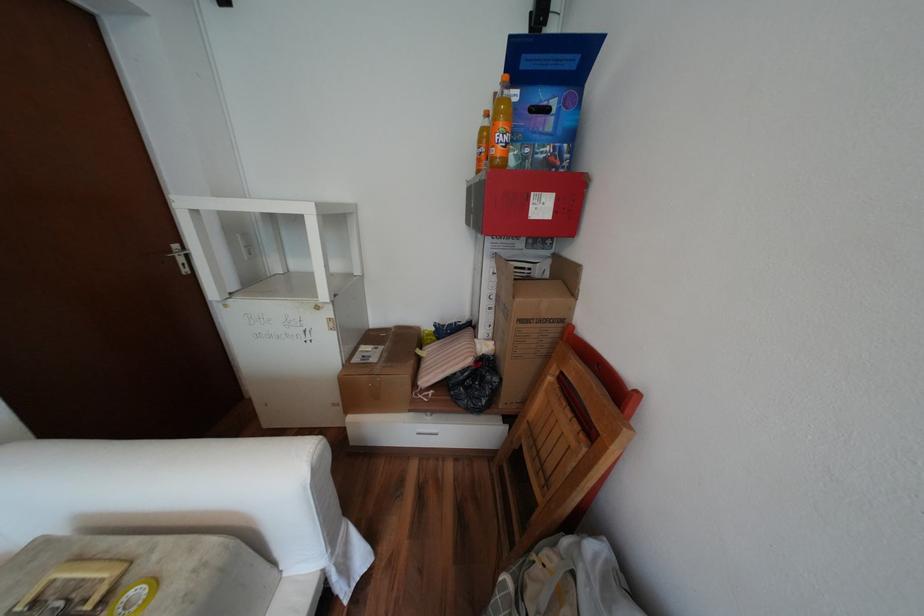
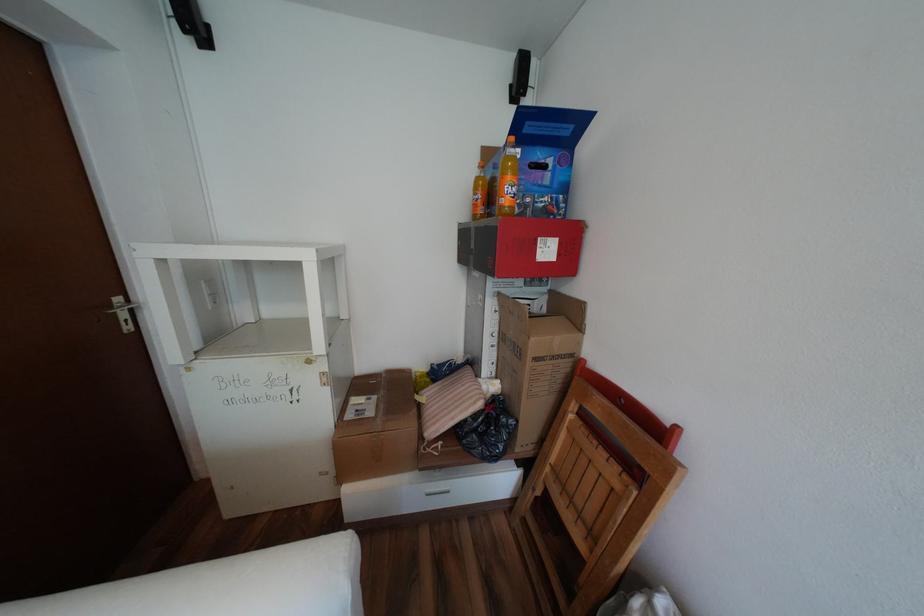
Question: What movement of the cameraman would produce the second image?

Choices:
 (A) Left
 (B) Right
 (C) Forward
 (D) Backward

Answer: (A)